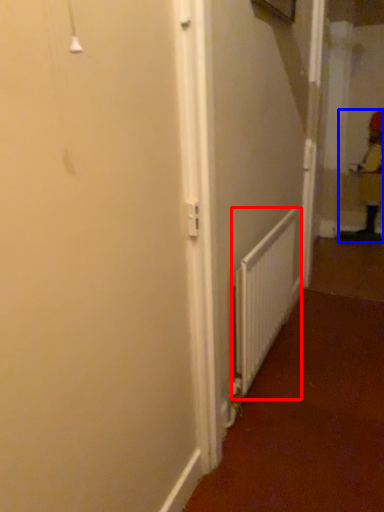
Question: Which point is further to the camera, radiator (highlighted by a red box) or worker (highlighted by a blue box)?

Choices:
 (A) radiator
 (B) worker

Answer: (B)